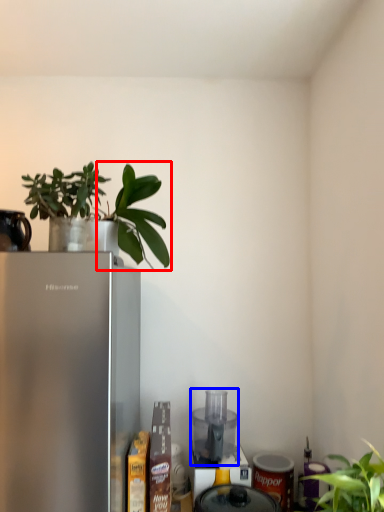
Question: Which point is further to the camera, plant (highlighted by a red box) or appliance (highlighted by a blue box)?

Choices:
 (A) plant
 (B) appliance

Answer: (B)